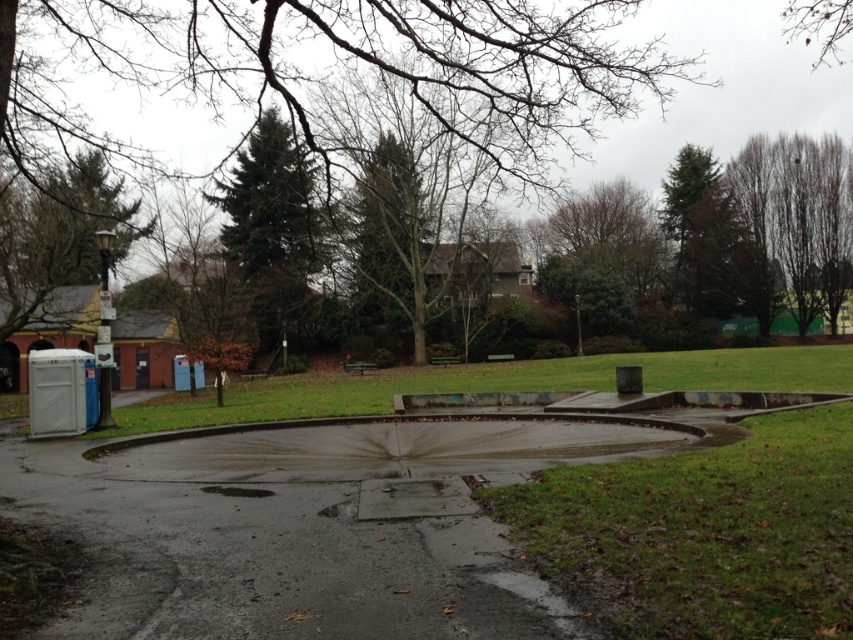
Question: Which object is positioned farthest from the brown leafy tree at upper right?

Choices:
 (A) green textured tree at upper center
 (B) green textured tree at upper left

Answer: (B)

Question: Considering the real-world distances, which object is closest to the brown leafy tree at upper right?

Choices:
 (A) green textured tree at upper left
 (B) green textured tree at upper center

Answer: (B)

Question: From the image, what is the correct spatial relationship of green textured tree at upper left in relation to brown leafy tree at upper right?

Choices:
 (A) left
 (B) right

Answer: (A)

Question: Does green textured tree at upper center appear on the left side of green textured tree at upper left?

Choices:
 (A) no
 (B) yes

Answer: (A)

Question: Which point is farther from the camera taking this photo?

Choices:
 (A) (299, 323)
 (B) (65, 272)

Answer: (A)

Question: Can you confirm if green textured tree at upper center is positioned above brown leafy tree at upper right?

Choices:
 (A) no
 (B) yes

Answer: (A)